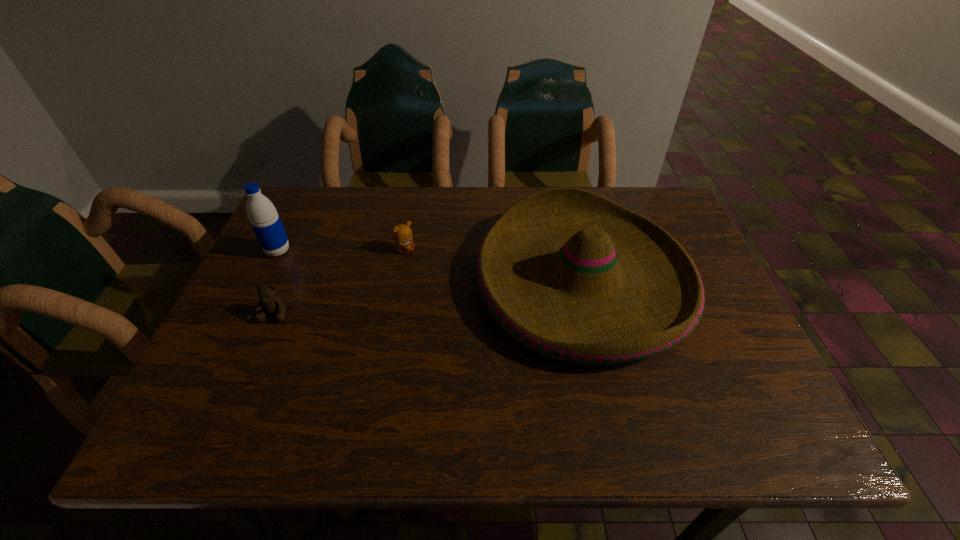
Find the location of `vacant space that satisfies the following two spatial constraints: 1. on the face of the farther teddy bear; 2. on the left side of the third shortest object`. vacant space that satisfies the following two spatial constraints: 1. on the face of the farther teddy bear; 2. on the left side of the third shortest object is located at coordinates (399, 281).

Where is `free region that satisfies the following two spatial constraints: 1. on the face of the farther teddy bear; 2. on the back side of the second tallest object`? free region that satisfies the following two spatial constraints: 1. on the face of the farther teddy bear; 2. on the back side of the second tallest object is located at coordinates (399, 281).

The height and width of the screenshot is (540, 960). I want to click on free point that satisfies the following two spatial constraints: 1. on the face of the second object from right to left; 2. on the front-facing side of the nearer teddy bear, so click(x=393, y=314).

Locate an element on the screen. This screenshot has height=540, width=960. free space that satisfies the following two spatial constraints: 1. on the face of the farther teddy bear; 2. on the front-facing side of the nearer teddy bear is located at coordinates (393, 314).

Locate an element on the screen. This screenshot has height=540, width=960. vacant point that satisfies the following two spatial constraints: 1. on the face of the third object from left to right; 2. on the front-facing side of the nearer teddy bear is located at coordinates (393, 314).

The height and width of the screenshot is (540, 960). What are the coordinates of `free point that satisfies the following two spatial constraints: 1. on the face of the third object from left to right; 2. on the front-facing side of the left teddy bear` in the screenshot? It's located at (393, 314).